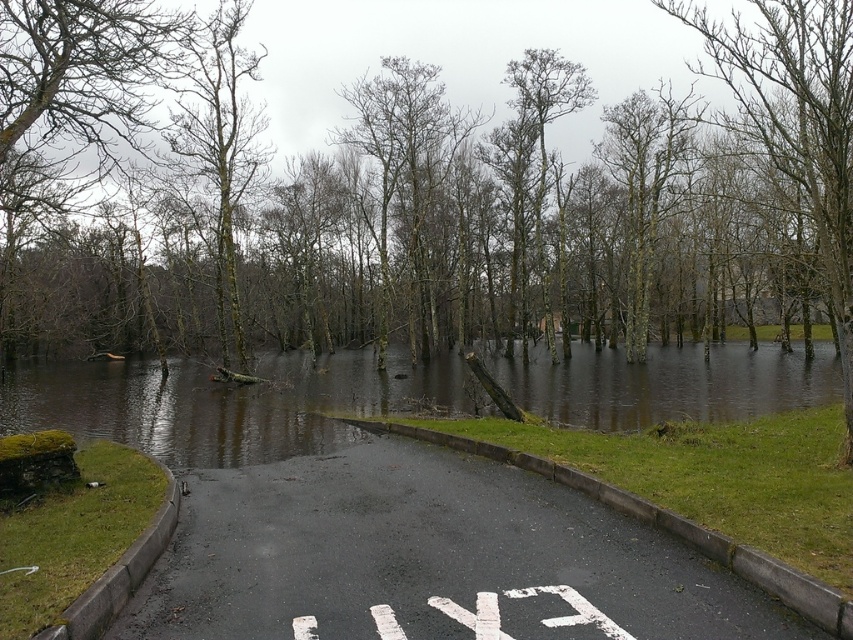
Does green leafless tree at center have a larger size compared to brown murky water at center?

Yes, green leafless tree at center is bigger than brown murky water at center.

Measure the distance from green leafless tree at center to brown murky water at center.

green leafless tree at center and brown murky water at center are 5.01 meters apart from each other.

The image size is (853, 640). Find the location of `green leafless tree at center`. green leafless tree at center is located at coordinates (500, 244).

Where is `green leafless tree at center`? The width and height of the screenshot is (853, 640). green leafless tree at center is located at coordinates (500, 244).

Between point (200, 371) and point (230, 188), which one is positioned in front?

Point (230, 188) is in front.

Is point (791, 403) closer to viewer compared to point (219, 148)?

That is True.

Identify the location of brown murky water at center. This screenshot has width=853, height=640. point(230,403).

The width and height of the screenshot is (853, 640). Identify the location of brown murky water at center. (230, 403).

Which is above, smooth bark tree at upper center or bare wood tree at center?

Positioned higher is bare wood tree at center.

Based on the photo, does smooth bark tree at upper center appear over bare wood tree at center?

Incorrect, smooth bark tree at upper center is not positioned above bare wood tree at center.

Locate an element on the screen. smooth bark tree at upper center is located at coordinates (796, 124).